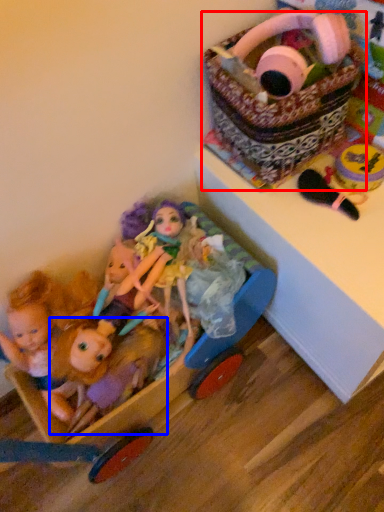
Question: Which point is further to the camera, basket (highlighted by a red box) or doll (highlighted by a blue box)?

Choices:
 (A) basket
 (B) doll

Answer: (B)